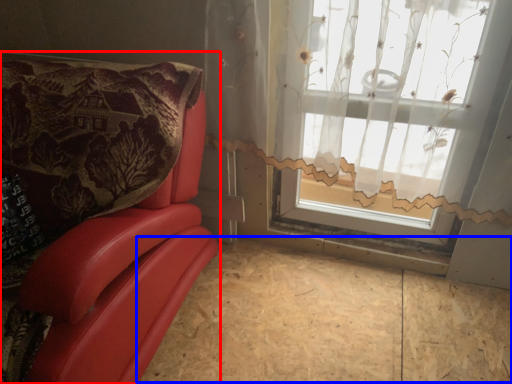
Question: Which point is closer to the camera, furniture (highlighted by a red box) or plywood (highlighted by a blue box)?

Choices:
 (A) furniture
 (B) plywood

Answer: (A)